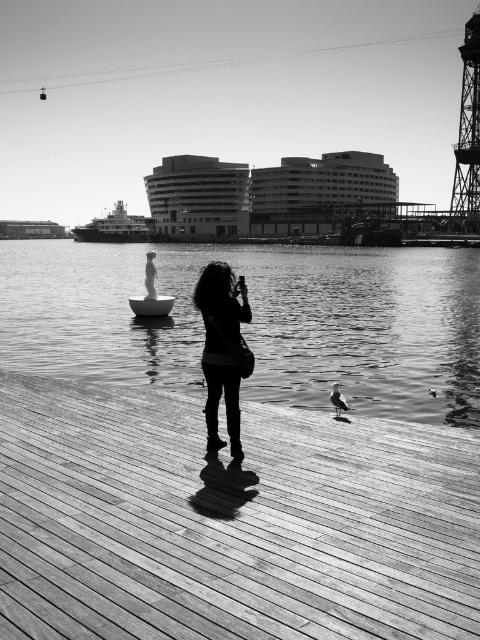
Question: Does wooden at center come in front of metallic ship at center?

Choices:
 (A) yes
 (B) no

Answer: (A)

Question: Which of the following is the closest to the observer?

Choices:
 (A) silky black hair at center
 (B) transparent water at center

Answer: (A)

Question: Which point appears closest to the camera in this image?

Choices:
 (A) (410, 324)
 (B) (124, 218)

Answer: (A)

Question: Can you confirm if wooden at center is bigger than metallic ship at center?

Choices:
 (A) yes
 (B) no

Answer: (B)

Question: Does transparent water at center have a greater width compared to silky black hair at center?

Choices:
 (A) yes
 (B) no

Answer: (A)

Question: Among these points, which one is farthest from the camera?

Choices:
 (A) (1, 586)
 (B) (204, 289)

Answer: (B)